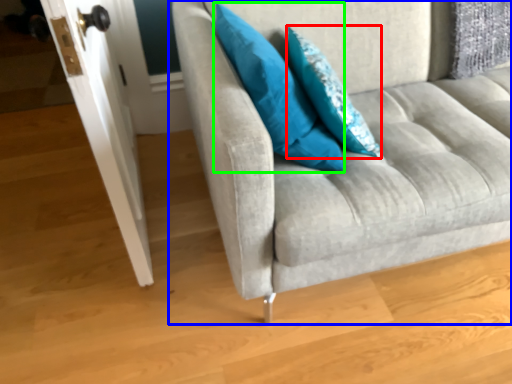
Question: Based on their relative distances, which object is nearer to pillow (highlighted by a red box)? Choose from studio couch (highlighted by a blue box) and pillow (highlighted by a green box).

Choices:
 (A) studio couch
 (B) pillow

Answer: (B)